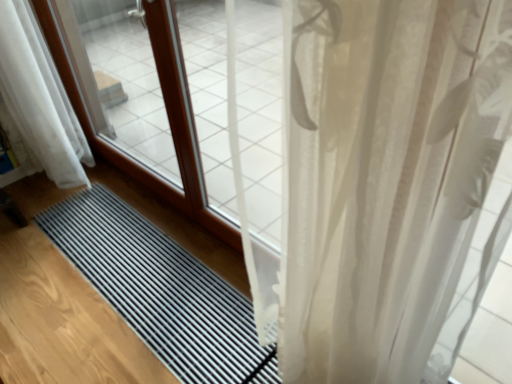
Question: Is black rubber mat at center aimed at white sheer curtain at lower left, the second curtain when ordered from right to left?

Choices:
 (A) no
 (B) yes

Answer: (A)

Question: Does black rubber mat at center have a smaller size compared to white sheer curtain at lower left, the second curtain when ordered from right to left?

Choices:
 (A) yes
 (B) no

Answer: (A)

Question: Does black rubber mat at center have a larger size compared to white sheer curtain at lower left, positioned as the second curtain in front-to-back order?

Choices:
 (A) yes
 (B) no

Answer: (B)

Question: Can you confirm if black rubber mat at center is wider than white sheer curtain at lower left, which is counted as the 1th curtain, starting from the left?

Choices:
 (A) no
 (B) yes

Answer: (B)

Question: Is black rubber mat at center to the right of white sheer curtain at lower left, which is counted as the 1th curtain, starting from the left, from the viewer's perspective?

Choices:
 (A) yes
 (B) no

Answer: (A)

Question: Can you confirm if black rubber mat at center is taller than white sheer curtain at lower left, the second curtain when ordered from right to left?

Choices:
 (A) no
 (B) yes

Answer: (A)

Question: Does white sheer curtain at lower left, which is counted as the 1th curtain, starting from the left, have a greater width compared to black rubber mat at center?

Choices:
 (A) yes
 (B) no

Answer: (B)

Question: Is white sheer curtain at lower left, the second curtain when ordered from right to left, oriented towards black rubber mat at center?

Choices:
 (A) yes
 (B) no

Answer: (B)

Question: Is white sheer curtain at lower left, positioned as the second curtain in front-to-back order, at the left side of black rubber mat at center?

Choices:
 (A) no
 (B) yes

Answer: (B)

Question: Can you confirm if white sheer curtain at lower left, which appears as the first curtain when viewed from the back, is shorter than black rubber mat at center?

Choices:
 (A) no
 (B) yes

Answer: (A)

Question: Does white sheer curtain at lower left, which appears as the first curtain when viewed from the back, appear on the right side of black rubber mat at center?

Choices:
 (A) yes
 (B) no

Answer: (B)

Question: From the image's perspective, is white sheer curtain at lower left, which appears as the first curtain when viewed from the back, above black rubber mat at center?

Choices:
 (A) no
 (B) yes

Answer: (B)

Question: Is white sheer curtain at lower left, the second curtain when ordered from right to left, completely or partially inside translucent white curtain at right, marked as the second curtain in a back-to-front arrangement?

Choices:
 (A) yes
 (B) no

Answer: (B)